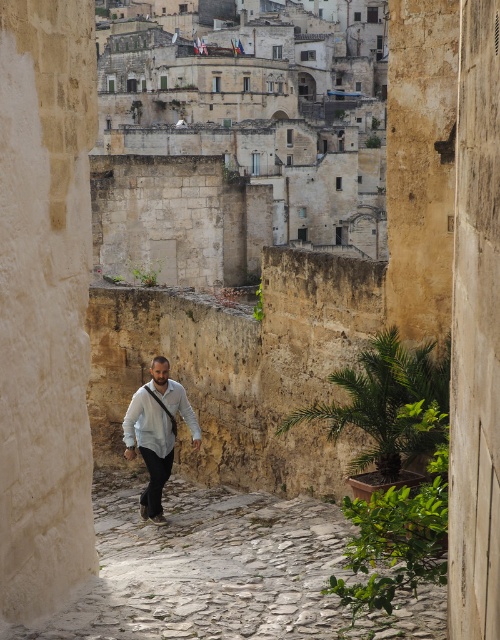
Between point (199, 436) and point (170, 380), which one is positioned behind?

Point (170, 380)

Between white matte shirt at center and white cotton shirt at center, which one appears on the right side from the viewer's perspective?

white matte shirt at center is more to the right.

Measure the distance between white matte shirt at center and camera.

white matte shirt at center and camera are 51.38 meters apart from each other.

Identify the location of white matte shirt at center. Image resolution: width=500 pixels, height=640 pixels. (157, 432).

Is point (330, 163) in front of point (306, 616)?

That is False.

Is beige stone buildings at upper center to the left of stone cobblestone path at center from the viewer's perspective?

Indeed, beige stone buildings at upper center is positioned on the left side of stone cobblestone path at center.

Find the location of `beige stone buildings at upper center`. beige stone buildings at upper center is located at coordinates (240, 147).

At what (x,y) coordinates should I click in order to perform the action: click on beige stone buildings at upper center. Please return your answer as a coordinate pair (x, y). This screenshot has width=500, height=640. Looking at the image, I should click on (240, 147).

Is beige stone buildings at upper center to the right of white matte shirt at center from the viewer's perspective?

Incorrect, beige stone buildings at upper center is not on the right side of white matte shirt at center.

Which is behind, point (179, 58) or point (166, 458)?

The point (179, 58) is more distant.

Between point (378, 220) and point (165, 465), which one is positioned behind?

The point (378, 220) is behind.

Locate an element on the screen. beige stone buildings at upper center is located at coordinates (240, 147).